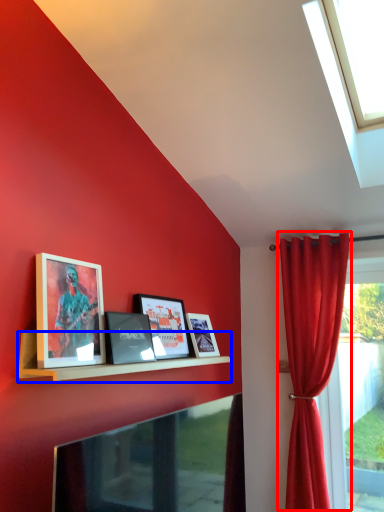
Question: Which object appears closest to the camera in this image, curtain (highlighted by a red box) or shelf (highlighted by a blue box)?

Choices:
 (A) curtain
 (B) shelf

Answer: (B)